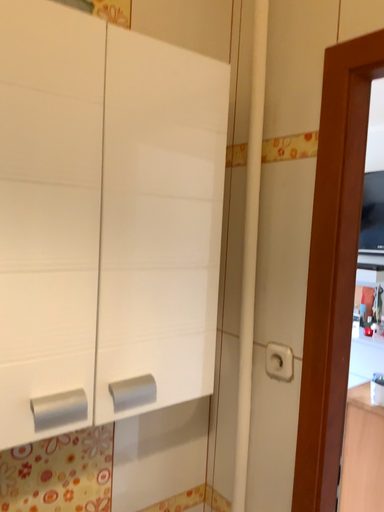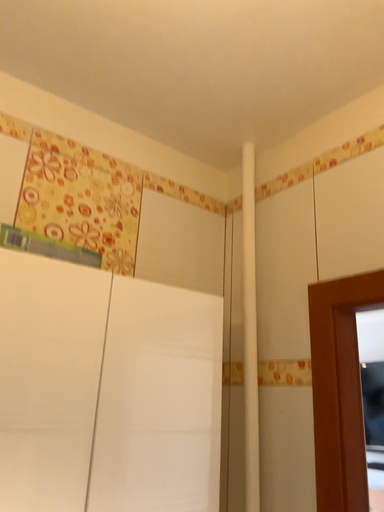
Question: Which way did the camera rotate in the video?

Choices:
 (A) rotated downward
 (B) rotated upward

Answer: (B)